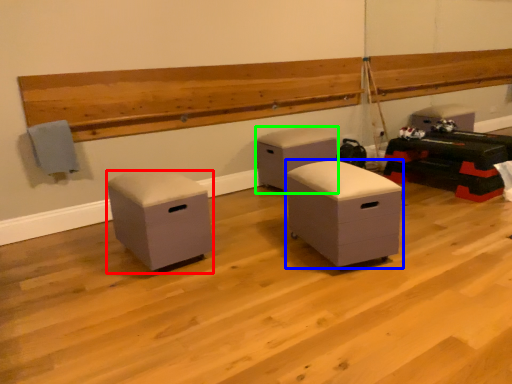
Question: Considering the real-world distances, which object is farthest from furniture (highlighted by a red box)? furniture (highlighted by a blue box) or furniture (highlighted by a green box)?

Choices:
 (A) furniture
 (B) furniture

Answer: (B)